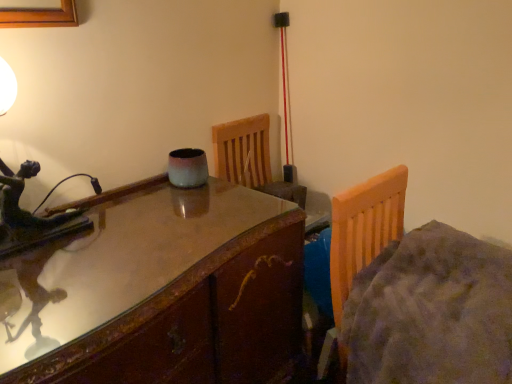
Question: Can you confirm if fuzzy gray bed at right is smaller than glossy wood table at center?

Choices:
 (A) yes
 (B) no

Answer: (A)

Question: Considering the relative positions of fuzzy gray bed at right and glossy wood table at center in the image provided, is fuzzy gray bed at right in front of glossy wood table at center?

Choices:
 (A) yes
 (B) no

Answer: (B)

Question: Would you say fuzzy gray bed at right is outside glossy wood table at center?

Choices:
 (A) no
 (B) yes

Answer: (B)

Question: Is fuzzy gray bed at right oriented away from glossy wood table at center?

Choices:
 (A) no
 (B) yes

Answer: (B)

Question: Is fuzzy gray bed at right wider than glossy wood table at center?

Choices:
 (A) no
 (B) yes

Answer: (A)

Question: Is fuzzy gray bed at right thinner than glossy wood table at center?

Choices:
 (A) yes
 (B) no

Answer: (A)

Question: From a real-world perspective, is glossy wood table at center on top of fuzzy gray bed at right?

Choices:
 (A) no
 (B) yes

Answer: (A)

Question: Considering the relative positions of glossy wood table at center and fuzzy gray bed at right in the image provided, is glossy wood table at center to the left of fuzzy gray bed at right from the viewer's perspective?

Choices:
 (A) yes
 (B) no

Answer: (A)

Question: Can you confirm if glossy wood table at center is thinner than fuzzy gray bed at right?

Choices:
 (A) yes
 (B) no

Answer: (B)

Question: From the image's perspective, is glossy wood table at center on fuzzy gray bed at right?

Choices:
 (A) no
 (B) yes

Answer: (A)

Question: Is fuzzy gray bed at right surrounded by glossy wood table at center?

Choices:
 (A) yes
 (B) no

Answer: (B)

Question: Considering the relative sizes of glossy wood table at center and fuzzy gray bed at right in the image provided, is glossy wood table at center shorter than fuzzy gray bed at right?

Choices:
 (A) yes
 (B) no

Answer: (B)

Question: Based on their sizes in the image, would you say fuzzy gray bed at right is bigger or smaller than glossy wood table at center?

Choices:
 (A) big
 (B) small

Answer: (B)